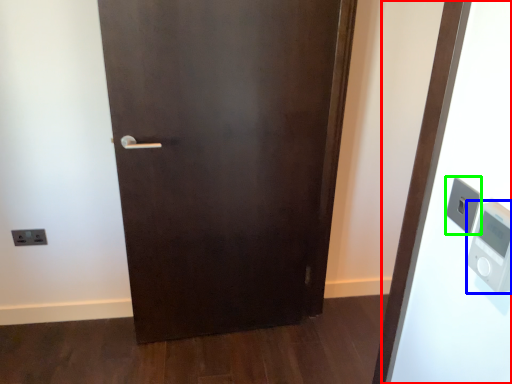
Question: Which object is the closest to the elevator (highlighted by a red box)? Choose among these: thermometer (highlighted by a blue box) or light switch (highlighted by a green box).

Choices:
 (A) thermometer
 (B) light switch

Answer: (B)